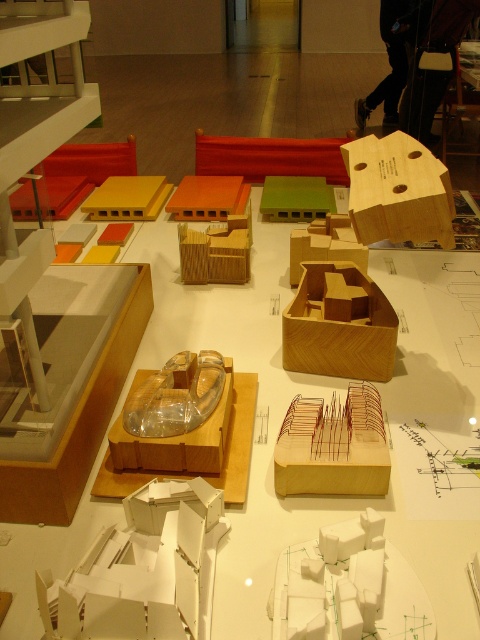
Question: Among these objects, which one is nearest to the camera?

Choices:
 (A) wooden box at center-right
 (B) wooden cube at center

Answer: (A)

Question: Is wooden model at center to the right of wooden box at center from the viewer's perspective?

Choices:
 (A) yes
 (B) no

Answer: (B)

Question: Which object appears closest to the camera in this image?

Choices:
 (A) wooden box at center-right
 (B) transparent plastic box at center

Answer: (B)

Question: Does wooden model at center appear on the right side of transparent plastic box at center?

Choices:
 (A) no
 (B) yes

Answer: (B)

Question: Among these objects, which one is nearest to the camera?

Choices:
 (A) wooden cube at center
 (B) transparent plastic box at center

Answer: (B)

Question: Does wooden box at center-right have a larger size compared to wooden cube at center?

Choices:
 (A) no
 (B) yes

Answer: (B)